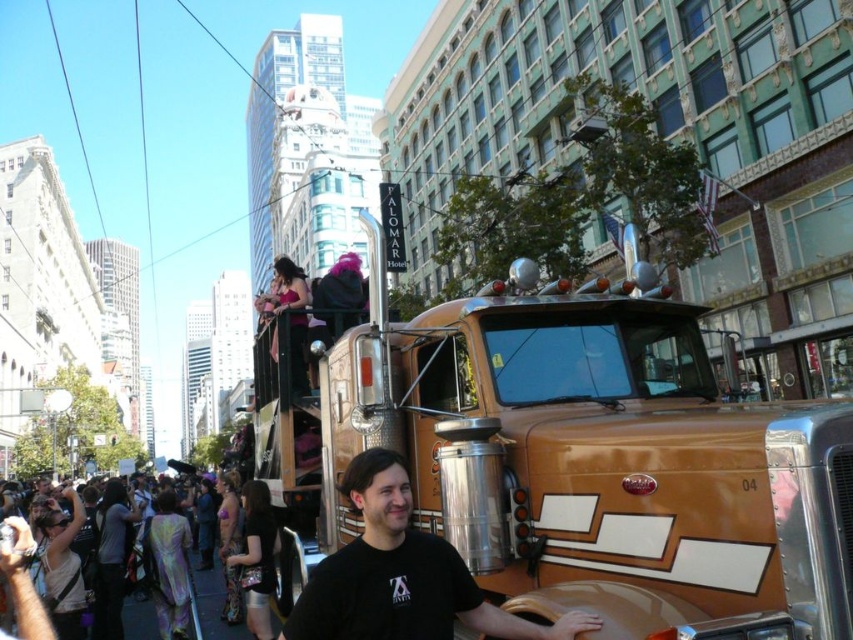
Is gold metallic truck at center positioned at the back of black matte shirt at center?

No, gold metallic truck at center is in front of black matte shirt at center.

Who is positioned more to the right, gold metallic truck at center or black matte shirt at center?

black matte shirt at center

Where is `gold metallic truck at center`? The image size is (853, 640). gold metallic truck at center is located at coordinates (573, 458).

Can you confirm if gold metallic truck at center is positioned to the right of holographic fabric crowd at lower left?

Indeed, gold metallic truck at center is positioned on the right side of holographic fabric crowd at lower left.

Is the position of gold metallic truck at center less distant than that of holographic fabric crowd at lower left?

Yes, gold metallic truck at center is in front of holographic fabric crowd at lower left.

Where is `gold metallic truck at center`? The height and width of the screenshot is (640, 853). gold metallic truck at center is located at coordinates (573, 458).

Is point (404, 492) positioned behind point (213, 624)?

No, it is not.

Between black matte shirt at center and holographic fabric crowd at lower left, which one is positioned higher?

black matte shirt at center is higher up.

Identify the location of black matte shirt at center. (401, 576).

The height and width of the screenshot is (640, 853). In order to click on black matte shirt at center in this screenshot , I will do click(401, 576).